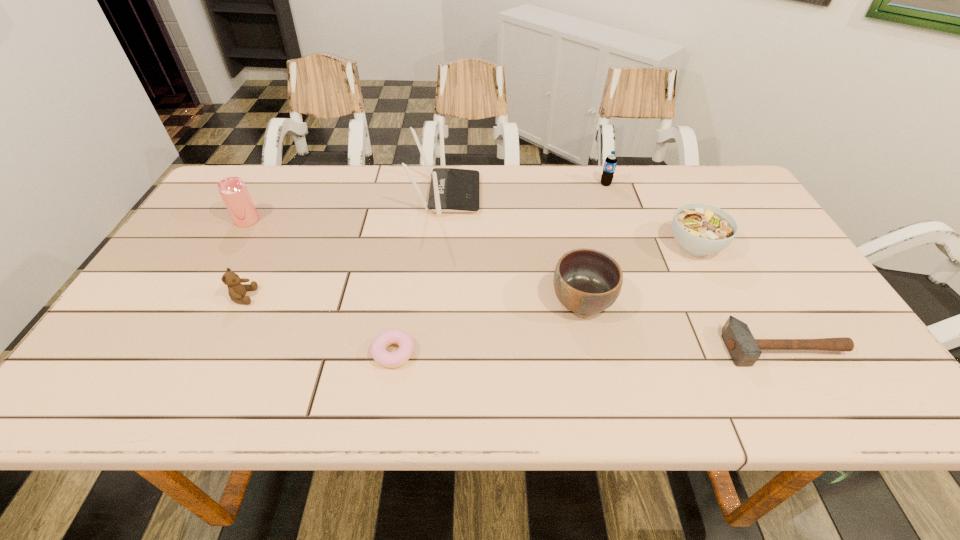
I want to click on the tallest object, so pos(451,190).

What are the coordinates of `beer can` in the screenshot? It's located at 233,190.

Image resolution: width=960 pixels, height=540 pixels. I want to click on the sixth object from left to right, so click(x=610, y=162).

The width and height of the screenshot is (960, 540). I want to click on the fifth object from left to right, so click(x=586, y=281).

I want to click on soup bowl, so click(x=700, y=229).

This screenshot has height=540, width=960. In order to click on teddy bear in this screenshot , I will do `click(236, 290)`.

Where is `hammer`? The image size is (960, 540). hammer is located at coordinates (744, 350).

Find the location of a particular element. Image resolution: width=960 pixels, height=540 pixels. doughnut is located at coordinates (379, 353).

Find the location of a particular element. This screenshot has width=960, height=540. free space located on the front-facing side of the tallest object is located at coordinates (603, 194).

Image resolution: width=960 pixels, height=540 pixels. What are the coordinates of `vacant space situated on the back of the beer can` in the screenshot? It's located at (268, 185).